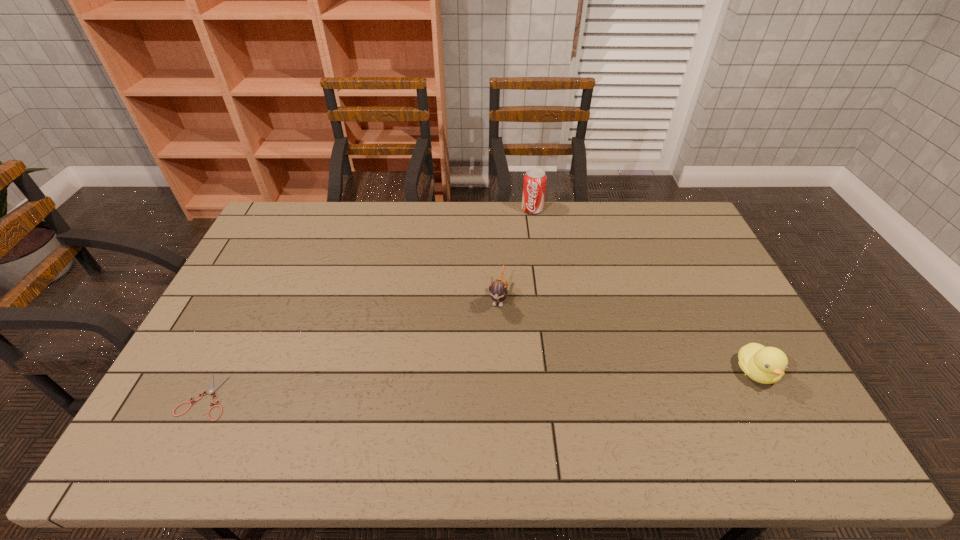
You are a GUI agent. You are given a task and a screenshot of the screen. Output one action in this format:
    pyautogui.click(x=<x>, y=<y>)
    Task: Click on the vacant space that's between the rightmost object and the third object from left to right
    The image size is (960, 540).
    Given the screenshot: What is the action you would take?
    pyautogui.click(x=644, y=291)

What are the coordinates of `vacant point located between the farthest object and the kitten` in the screenshot? It's located at (516, 253).

The height and width of the screenshot is (540, 960). In order to click on vacant space that's between the farthest object and the duckling in this screenshot , I will do `click(644, 291)`.

Where is `unoccupied area between the second object from left to right and the tallest object`? This screenshot has height=540, width=960. unoccupied area between the second object from left to right and the tallest object is located at coordinates point(516,253).

Where is `vacant space in between the third object from right to left and the rightmost object`? This screenshot has width=960, height=540. vacant space in between the third object from right to left and the rightmost object is located at coordinates (627, 334).

You are a GUI agent. You are given a task and a screenshot of the screen. Output one action in this format:
    pyautogui.click(x=<x>, y=<y>)
    Task: Click on the free spot between the kitten and the duckling
    This screenshot has width=960, height=540.
    Given the screenshot: What is the action you would take?
    point(627,334)

At what (x,y) coordinates should I click in order to perform the action: click on free space that is in between the second object from left to right and the shears. Please return your answer as a coordinate pair (x, y). Looking at the image, I should click on (351, 347).

The image size is (960, 540). Identify the location of empty space that is in between the tallest object and the kitten. (516, 253).

Find the location of a particular element. object that is the second closest to the second object from left to right is located at coordinates (766, 365).

Where is `the closest object to the farthest object`? the closest object to the farthest object is located at coordinates (498, 289).